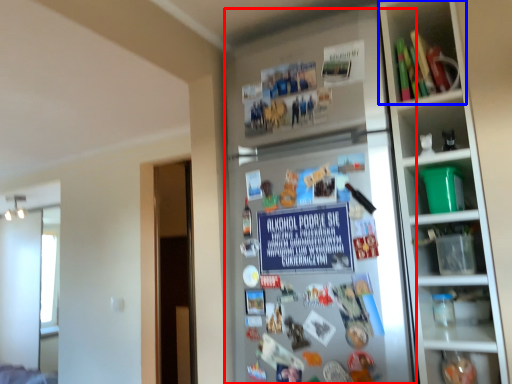
Question: Which point is closer to the camera, fridge (highlighted by a red box) or shelf (highlighted by a blue box)?

Choices:
 (A) fridge
 (B) shelf

Answer: (A)